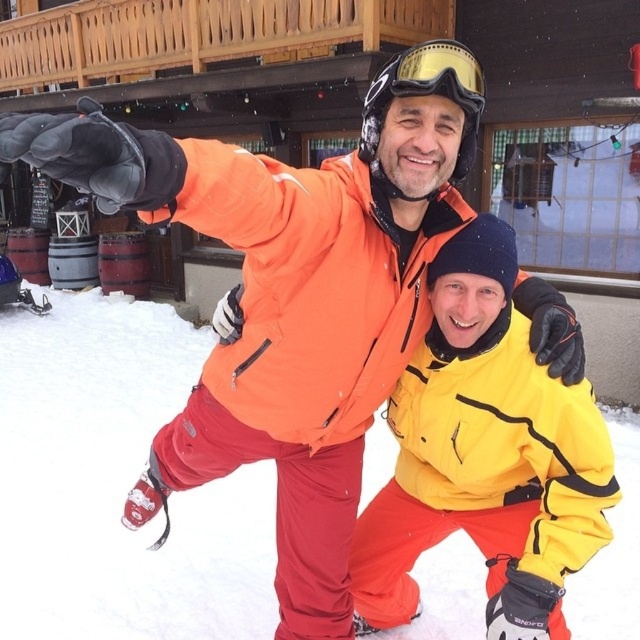
Where is `white powder snow at center`? white powder snow at center is located at coordinates (116, 484).

Does white powder snow at center appear on the right side of gold reflective goggles at upper center?

Yes, white powder snow at center is to the right of gold reflective goggles at upper center.

This screenshot has height=640, width=640. Identify the location of white powder snow at center. tap(116, 484).

Locate an element on the screen. white powder snow at center is located at coordinates (116, 484).

Is white powder snow at center positioned in front of yellow matte jacket at center?

No, it is behind yellow matte jacket at center.

Is point (200, 573) more distant than point (541, 570)?

Yes, it is behind point (541, 570).

This screenshot has width=640, height=640. Find the location of `white powder snow at center`. white powder snow at center is located at coordinates (116, 484).

Is point (512, 588) in front of point (435, 52)?

No, it is behind (435, 52).

Does yellow matte jacket at center appear over gold reflective goggles at upper center?

No.

Who is more distant from viewer, (518, 621) or (472, 102)?

Positioned behind is point (518, 621).

This screenshot has width=640, height=640. Find the location of `yellow matte jacket at center`. yellow matte jacket at center is located at coordinates (484, 456).